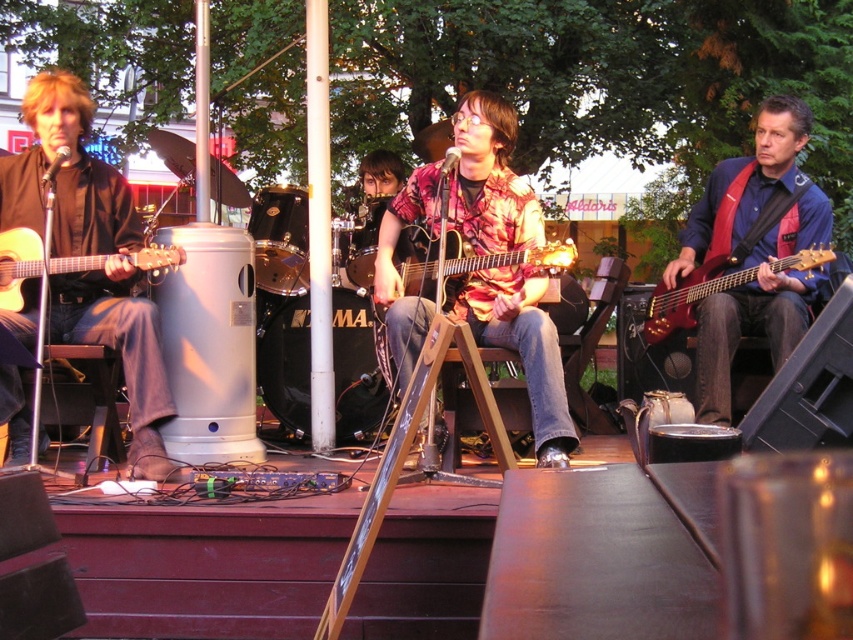
Is point (715, 237) positioned in front of point (527, 252)?

No, (715, 237) is behind (527, 252).

Is shiny red guitar at right positioned before wooden acoustic guitar at center?

No, shiny red guitar at right is behind wooden acoustic guitar at center.

The width and height of the screenshot is (853, 640). In order to click on shiny red guitar at right in this screenshot , I will do `click(753, 250)`.

Is the position of matte black guitar at left more distant than that of wooden acoustic guitar at center?

Yes.

Is matte black guitar at left to the right of wooden acoustic guitar at center from the viewer's perspective?

No, matte black guitar at left is not to the right of wooden acoustic guitar at center.

Is point (149, 328) positioned after point (554, 257)?

Yes, it is behind point (554, 257).

At what (x,y) coordinates should I click in order to perform the action: click on matte black guitar at left. Please return your answer as a coordinate pair (x, y). The width and height of the screenshot is (853, 640). Looking at the image, I should click on (91, 253).

Who is positioned more to the right, matte black guitar at left or matte floral shirt at center?

Positioned to the right is matte floral shirt at center.

Consider the image. Does matte black guitar at left appear on the right side of matte floral shirt at center?

Incorrect, matte black guitar at left is not on the right side of matte floral shirt at center.

Who is more forward, (112, 284) or (405, 307)?

Point (405, 307)

You are a GUI agent. You are given a task and a screenshot of the screen. Output one action in this format:
    pyautogui.click(x=<x>, y=<y>)
    Task: Click on the matte black guitar at left
    
    Given the screenshot: What is the action you would take?
    pyautogui.click(x=91, y=253)